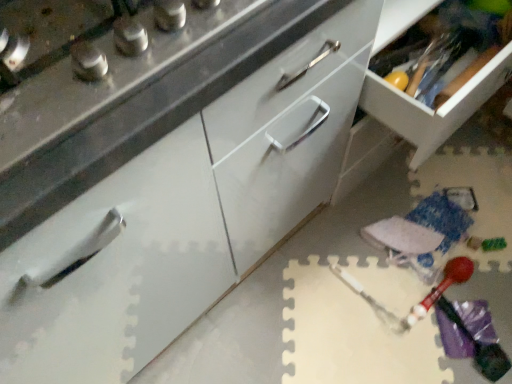
This screenshot has height=384, width=512. Describe the element at coordinates (430, 109) in the screenshot. I see `white glossy drawer at center, the 2th cabinetry viewed from the left` at that location.

Locate an element on the screen. white glossy drawer at center, the 2th cabinetry viewed from the left is located at coordinates (430, 109).

This screenshot has height=384, width=512. What do you see at coordinates (158, 163) in the screenshot?
I see `matte white drawer at center, marked as the second cabinetry in a right-to-left arrangement` at bounding box center [158, 163].

Locate an element on the screen. The width and height of the screenshot is (512, 384). matte white drawer at center, acting as the first cabinetry starting from the left is located at coordinates 158,163.

Find the location of `white glossy drawer at center, the 2th cabinetry viewed from the left`. white glossy drawer at center, the 2th cabinetry viewed from the left is located at coordinates (430, 109).

Can you confirm if white glossy drawer at center, the 1th cabinetry in the right-to-left sequence, is positioned to the left of matte white drawer at center, marked as the second cabinetry in a right-to-left arrangement?

No, white glossy drawer at center, the 1th cabinetry in the right-to-left sequence, is not to the left of matte white drawer at center, marked as the second cabinetry in a right-to-left arrangement.

Considering their positions, is white glossy drawer at center, the 1th cabinetry in the right-to-left sequence, located in front of or behind matte white drawer at center, marked as the second cabinetry in a right-to-left arrangement?

white glossy drawer at center, the 1th cabinetry in the right-to-left sequence, is behind matte white drawer at center, marked as the second cabinetry in a right-to-left arrangement.

Considering the positions of point (471, 104) and point (74, 15), is point (471, 104) closer or farther from the camera than point (74, 15)?

Clearly, point (471, 104) is more distant from the camera than point (74, 15).

From the image's perspective, is white glossy drawer at center, the 2th cabinetry viewed from the left, above or below matte white drawer at center, acting as the first cabinetry starting from the left?

white glossy drawer at center, the 2th cabinetry viewed from the left, is above matte white drawer at center, acting as the first cabinetry starting from the left.

From a real-world perspective, which is physically below, white glossy drawer at center, the 1th cabinetry in the right-to-left sequence, or matte white drawer at center, acting as the first cabinetry starting from the left?

In real-world perspective, matte white drawer at center, acting as the first cabinetry starting from the left, is lower.

Which of these two, white glossy drawer at center, the 1th cabinetry in the right-to-left sequence, or matte white drawer at center, marked as the second cabinetry in a right-to-left arrangement, is thinner?

white glossy drawer at center, the 1th cabinetry in the right-to-left sequence, is thinner.

In terms of height, does white glossy drawer at center, the 2th cabinetry viewed from the left, look taller or shorter compared to matte white drawer at center, acting as the first cabinetry starting from the left?

In the image, white glossy drawer at center, the 2th cabinetry viewed from the left, appears to be shorter than matte white drawer at center, acting as the first cabinetry starting from the left.

Is white glossy drawer at center, the 1th cabinetry in the right-to-left sequence, bigger or smaller than matte white drawer at center, acting as the first cabinetry starting from the left?

white glossy drawer at center, the 1th cabinetry in the right-to-left sequence, is smaller than matte white drawer at center, acting as the first cabinetry starting from the left.

Choose the correct answer: Is white glossy drawer at center, the 2th cabinetry viewed from the left, inside matte white drawer at center, marked as the second cabinetry in a right-to-left arrangement, or outside it?

The correct answer is: outside.

Would you consider white glossy drawer at center, the 1th cabinetry in the right-to-left sequence, to be distant from matte white drawer at center, marked as the second cabinetry in a right-to-left arrangement?

No, white glossy drawer at center, the 1th cabinetry in the right-to-left sequence, is not far from matte white drawer at center, marked as the second cabinetry in a right-to-left arrangement.

Is white glossy drawer at center, the 1th cabinetry in the right-to-left sequence, facing towards matte white drawer at center, acting as the first cabinetry starting from the left?

No.

What's the angular difference between white glossy drawer at center, the 1th cabinetry in the right-to-left sequence, and matte white drawer at center, acting as the first cabinetry starting from the left,'s facing directions?

0.188 degrees.

I want to click on cabinetry on the left of white glossy drawer at center, the 2th cabinetry viewed from the left, so click(x=158, y=163).

Can you confirm if matte white drawer at center, marked as the second cabinetry in a right-to-left arrangement, is positioned to the left of white glossy drawer at center, the 2th cabinetry viewed from the left?

Yes, matte white drawer at center, marked as the second cabinetry in a right-to-left arrangement, is to the left of white glossy drawer at center, the 2th cabinetry viewed from the left.

Is matte white drawer at center, acting as the first cabinetry starting from the left, further to camera compared to white glossy drawer at center, the 1th cabinetry in the right-to-left sequence?

No, matte white drawer at center, acting as the first cabinetry starting from the left, is in front of white glossy drawer at center, the 1th cabinetry in the right-to-left sequence.

Is point (304, 68) in front of point (418, 146)?

Yes, point (304, 68) is closer to viewer.

From the image's perspective, is matte white drawer at center, marked as the second cabinetry in a right-to-left arrangement, below white glossy drawer at center, the 1th cabinetry in the right-to-left sequence?

Yes, from the image's perspective, matte white drawer at center, marked as the second cabinetry in a right-to-left arrangement, is below white glossy drawer at center, the 1th cabinetry in the right-to-left sequence.

From a real-world perspective, is matte white drawer at center, marked as the second cabinetry in a right-to-left arrangement, beneath white glossy drawer at center, the 2th cabinetry viewed from the left?

Yes.

Does matte white drawer at center, marked as the second cabinetry in a right-to-left arrangement, have a greater width compared to white glossy drawer at center, the 2th cabinetry viewed from the left?

Indeed, matte white drawer at center, marked as the second cabinetry in a right-to-left arrangement, has a greater width compared to white glossy drawer at center, the 2th cabinetry viewed from the left.

Does matte white drawer at center, acting as the first cabinetry starting from the left, have a greater height compared to white glossy drawer at center, the 1th cabinetry in the right-to-left sequence?

Yes.

Can you confirm if matte white drawer at center, acting as the first cabinetry starting from the left, is smaller than white glossy drawer at center, the 2th cabinetry viewed from the left?

No.

Is matte white drawer at center, marked as the second cabinetry in a right-to-left arrangement, not within white glossy drawer at center, the 2th cabinetry viewed from the left?

Yes.

Are matte white drawer at center, marked as the second cabinetry in a right-to-left arrangement, and white glossy drawer at center, the 1th cabinetry in the right-to-left sequence, far apart?

No, matte white drawer at center, marked as the second cabinetry in a right-to-left arrangement, is not far away from white glossy drawer at center, the 1th cabinetry in the right-to-left sequence.

Could you tell me if matte white drawer at center, acting as the first cabinetry starting from the left, is turned towards white glossy drawer at center, the 1th cabinetry in the right-to-left sequence?

No, matte white drawer at center, acting as the first cabinetry starting from the left, is not aimed at white glossy drawer at center, the 1th cabinetry in the right-to-left sequence.

How different are the orientations of matte white drawer at center, marked as the second cabinetry in a right-to-left arrangement, and white glossy drawer at center, the 1th cabinetry in the right-to-left sequence, in degrees?

They differ by 0.188 degrees in their facing directions.

The height and width of the screenshot is (384, 512). In order to click on cabinetry lying in front of the white glossy drawer at center, the 1th cabinetry in the right-to-left sequence in this screenshot , I will do `click(158, 163)`.

Locate an element on the screen. The width and height of the screenshot is (512, 384). cabinetry on the right side of matte white drawer at center, acting as the first cabinetry starting from the left is located at coordinates (430, 109).

The height and width of the screenshot is (384, 512). Identify the location of cabinetry in front of the white glossy drawer at center, the 1th cabinetry in the right-to-left sequence. (158, 163).